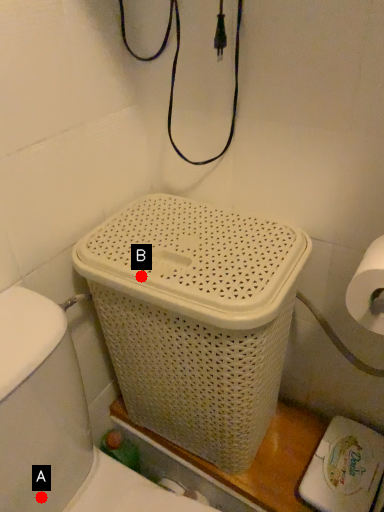
Question: Two points are circled on the image, labeled by A and B beside each circle. Which point is closer to the camera?

Choices:
 (A) A is closer
 (B) B is closer

Answer: (B)